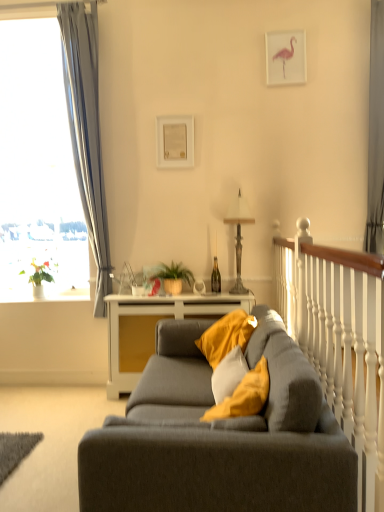
Question: Are matte gray couch at center and soft yellow cushion at center beside each other?

Choices:
 (A) no
 (B) yes

Answer: (A)

Question: Is matte gray couch at center to the right of soft yellow cushion at center from the viewer's perspective?

Choices:
 (A) yes
 (B) no

Answer: (B)

Question: Is matte gray couch at center smaller than soft yellow cushion at center?

Choices:
 (A) yes
 (B) no

Answer: (B)

Question: Is matte gray couch at center outside soft yellow cushion at center?

Choices:
 (A) no
 (B) yes

Answer: (B)

Question: From a real-world perspective, is matte gray couch at center physically above soft yellow cushion at center?

Choices:
 (A) yes
 (B) no

Answer: (B)

Question: Considering the positions of green matte plant at left, the second plant positioned from the front, and white wood table at center in the image, is green matte plant at left, the second plant positioned from the front, bigger or smaller than white wood table at center?

Choices:
 (A) big
 (B) small

Answer: (B)

Question: Considering the relative positions of green matte plant at left, which ranks as the first plant in back-to-front order, and white wood table at center in the image provided, is green matte plant at left, which ranks as the first plant in back-to-front order, to the left or to the right of white wood table at center?

Choices:
 (A) right
 (B) left

Answer: (B)

Question: From the image's perspective, is green matte plant at left, the second plant positioned from the front, located above or below white wood table at center?

Choices:
 (A) above
 (B) below

Answer: (A)

Question: Looking at their shapes, would you say green matte plant at left, which is the 1th plant from left to right, is wider or thinner than white wood table at center?

Choices:
 (A) thin
 (B) wide

Answer: (A)

Question: From the image's perspective, relative to gray fabric curtain at right, which appears as the 2th curtain when viewed from the left, is soft yellow cushion at center above or below?

Choices:
 (A) above
 (B) below

Answer: (B)

Question: Considering the positions of point (210, 419) and point (382, 145), is point (210, 419) closer or farther from the camera than point (382, 145)?

Choices:
 (A) farther
 (B) closer

Answer: (B)

Question: From a real-world perspective, is soft yellow cushion at center above or below gray fabric curtain at right, which appears as the 2th curtain when viewed from the left?

Choices:
 (A) above
 (B) below

Answer: (B)

Question: Relative to gray fabric curtain at right, which is counted as the 1th curtain, starting from the right, is soft yellow cushion at center in front or behind?

Choices:
 (A) behind
 (B) front

Answer: (B)

Question: Considering their positions, is metallic gray lamp at center located in front of or behind gray fabric curtain at right, which is counted as the 1th curtain, starting from the right?

Choices:
 (A) front
 (B) behind

Answer: (B)

Question: From a real-world perspective, relative to gray fabric curtain at right, which appears as the 2th curtain when viewed from the left, is metallic gray lamp at center vertically above or below?

Choices:
 (A) below
 (B) above

Answer: (A)